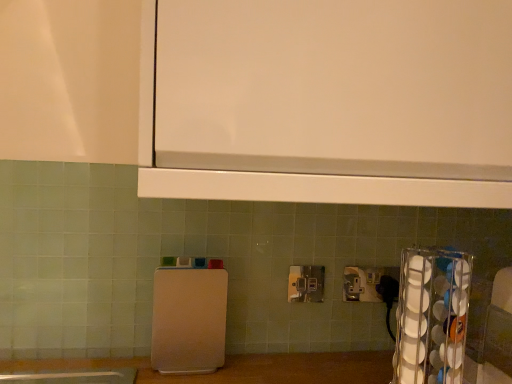
Question: Can you confirm if white plastic cutting board at center, which is the first appliance from back to front, is shorter than metallic silver power plugs and sockets at center?

Choices:
 (A) no
 (B) yes

Answer: (A)

Question: From the image's perspective, would you say white plastic cutting board at center, which is the first appliance from back to front, is shown under metallic silver power plugs and sockets at center?

Choices:
 (A) no
 (B) yes

Answer: (B)

Question: Is white plastic cutting board at center, marked as the second appliance in a front-to-back arrangement, taller than metallic silver power plugs and sockets at center?

Choices:
 (A) yes
 (B) no

Answer: (A)

Question: Is white plastic cutting board at center, the first appliance viewed from the left, wider than metallic silver power plugs and sockets at center?

Choices:
 (A) yes
 (B) no

Answer: (A)

Question: From a real-world perspective, is white plastic cutting board at center, the first appliance viewed from the left, on metallic silver power plugs and sockets at center?

Choices:
 (A) no
 (B) yes

Answer: (A)

Question: From the image's perspective, is white plastic cutting board at center, the first appliance viewed from the left, over metallic silver power plugs and sockets at center?

Choices:
 (A) yes
 (B) no

Answer: (B)

Question: Is clear plastic cup holder at right, positioned as the second appliance in left-to-right order, at the right side of metallic silver power plugs and sockets at center?

Choices:
 (A) no
 (B) yes

Answer: (B)

Question: Can you confirm if clear plastic cup holder at right, arranged as the 1th appliance when viewed from the right, is smaller than metallic silver power plugs and sockets at center?

Choices:
 (A) yes
 (B) no

Answer: (B)

Question: From the image's perspective, is clear plastic cup holder at right, arranged as the 1th appliance when viewed from the right, below metallic silver power plugs and sockets at center?

Choices:
 (A) yes
 (B) no

Answer: (A)

Question: From a real-world perspective, is clear plastic cup holder at right, positioned as the second appliance in left-to-right order, on metallic silver power plugs and sockets at center?

Choices:
 (A) yes
 (B) no

Answer: (B)

Question: Is clear plastic cup holder at right, positioned as the second appliance in left-to-right order, not inside metallic silver power plugs and sockets at center?

Choices:
 (A) no
 (B) yes

Answer: (B)

Question: Does clear plastic cup holder at right, acting as the second appliance starting from the back, turn towards metallic silver power plugs and sockets at center?

Choices:
 (A) no
 (B) yes

Answer: (A)

Question: Is clear plastic cup holder at right, which ranks as the first appliance in front-to-back order, taller than white plastic cutting board at center, the first appliance viewed from the left?

Choices:
 (A) no
 (B) yes

Answer: (B)